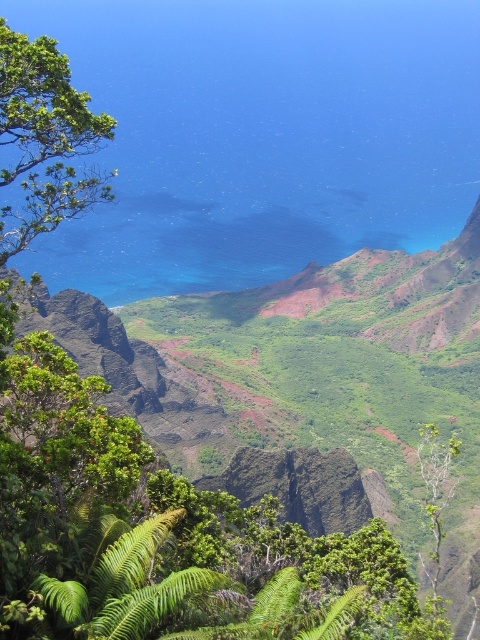
Consider the image. You are a hiker who wants to capture a photo of the blue water at center and the green leafy tree at upper left in the same frame. Based on their sizes in the image, which one would appear more prominent in your photo?

The blue water at center appears more prominent in the photo because it has a larger size compared to the green leafy tree at upper left.

You are a hiker standing at the top of the cliff looking out over the scene. You see the blue water at center and the green leafy tree at upper left. Which object is located to the left of the other?

The blue water at center is positioned on the left side of green leafy tree at upper left.